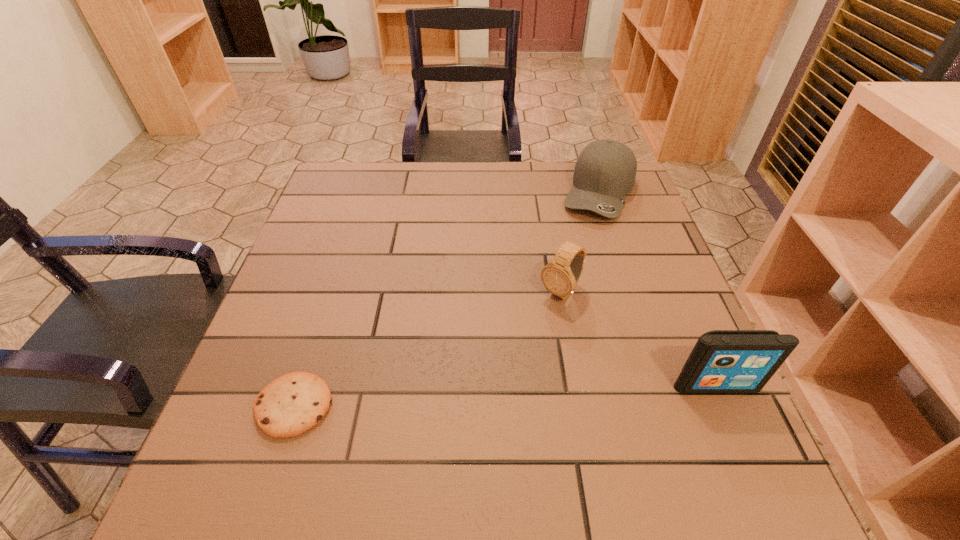
This screenshot has width=960, height=540. Find the location of `free area in between the baseball cap and the iPod`. free area in between the baseball cap and the iPod is located at coordinates (658, 289).

Find the location of a particular element. vacant region between the watch and the iPod is located at coordinates (638, 339).

The image size is (960, 540). What are the coordinates of `vacant area that lies between the iPod and the third object from right to left` in the screenshot? It's located at (638, 339).

Find the location of `free space between the iPod and the watch`. free space between the iPod and the watch is located at coordinates (638, 339).

I want to click on free spot between the third nearest object and the farthest object, so click(580, 242).

Locate an element on the screen. This screenshot has width=960, height=540. free spot between the second object from left to right and the shortest object is located at coordinates (427, 349).

Locate an element on the screen. Image resolution: width=960 pixels, height=540 pixels. the closest object to the iPod is located at coordinates (560, 276).

This screenshot has height=540, width=960. I want to click on object that is the second nearest to the baseball cap, so click(x=722, y=361).

At what (x,y) coordinates should I click in order to perform the action: click on vacant space that satisfies the following two spatial constraints: 1. on the back side of the farthest object; 2. on the left side of the cookie. Please return your answer as a coordinate pair (x, y). This screenshot has height=540, width=960. Looking at the image, I should click on (364, 192).